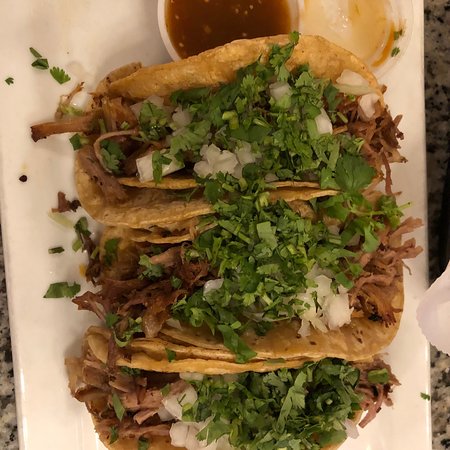
Identify the location of cup. This screenshot has height=450, width=450. (163, 18).